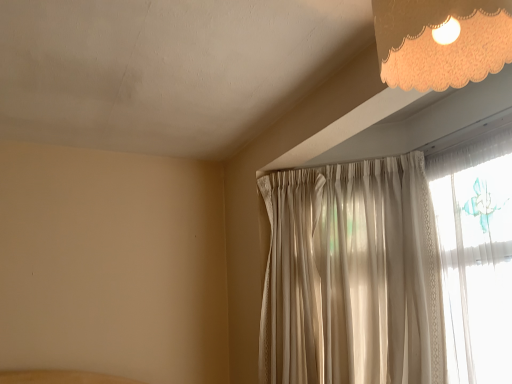
Question: Considering the relative sizes of ivory lace lampshade at upper right and silky white curtain at upper right in the image provided, is ivory lace lampshade at upper right taller than silky white curtain at upper right?

Choices:
 (A) no
 (B) yes

Answer: (A)

Question: Can you confirm if ivory lace lampshade at upper right is bigger than silky white curtain at upper right?

Choices:
 (A) no
 (B) yes

Answer: (A)

Question: Does ivory lace lampshade at upper right appear on the right side of silky white curtain at upper right?

Choices:
 (A) no
 (B) yes

Answer: (B)

Question: From the image's perspective, is ivory lace lampshade at upper right under silky white curtain at upper right?

Choices:
 (A) no
 (B) yes

Answer: (A)

Question: Is ivory lace lampshade at upper right looking in the opposite direction of silky white curtain at upper right?

Choices:
 (A) no
 (B) yes

Answer: (A)

Question: Is ivory lace lampshade at upper right smaller than silky white curtain at upper right?

Choices:
 (A) yes
 (B) no

Answer: (A)

Question: Is silky white curtain at upper right smaller than ivory lace lampshade at upper right?

Choices:
 (A) no
 (B) yes

Answer: (A)

Question: Is silky white curtain at upper right in front of ivory lace lampshade at upper right?

Choices:
 (A) yes
 (B) no

Answer: (B)

Question: Is ivory lace lampshade at upper right located within silky white curtain at upper right?

Choices:
 (A) no
 (B) yes

Answer: (A)

Question: Can you confirm if silky white curtain at upper right is shorter than ivory lace lampshade at upper right?

Choices:
 (A) no
 (B) yes

Answer: (A)

Question: Can you confirm if silky white curtain at upper right is positioned to the right of ivory lace lampshade at upper right?

Choices:
 (A) no
 (B) yes

Answer: (A)

Question: Does silky white curtain at upper right have a lesser width compared to ivory lace lampshade at upper right?

Choices:
 (A) yes
 (B) no

Answer: (B)

Question: Considering the positions of ivory lace lampshade at upper right and silky white curtain at upper right in the image, is ivory lace lampshade at upper right bigger or smaller than silky white curtain at upper right?

Choices:
 (A) big
 (B) small

Answer: (B)